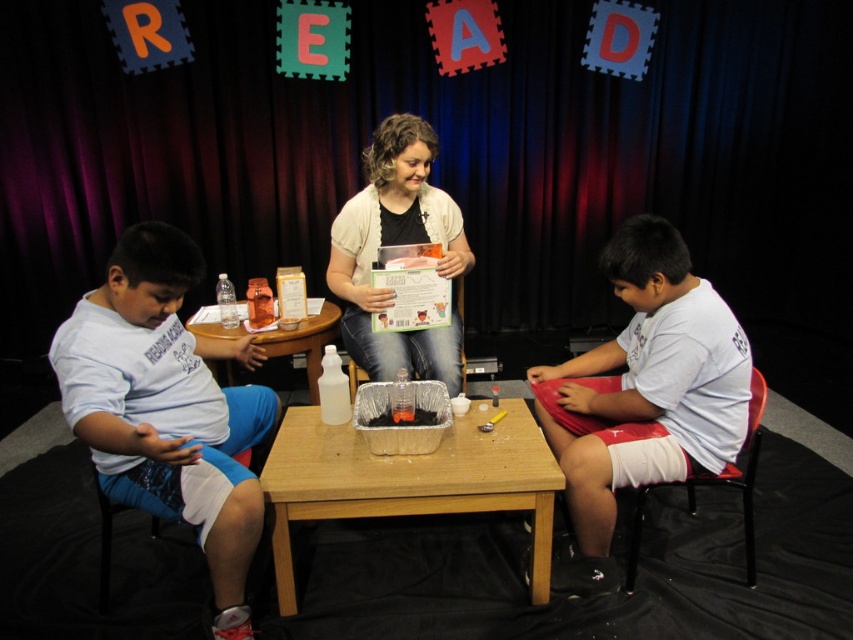
Between wooden table at center and white matte cardigan at center, which one is positioned higher?

Positioned higher is white matte cardigan at center.

Which is behind, point (506, 468) or point (440, 269)?

The point (440, 269) is more distant.

Is point (498, 470) positioned behind point (375, 339)?

That is False.

I want to click on wooden table at center, so click(409, 481).

Which is more to the right, light blue cotton shorts at left or wooden table at center?

From the viewer's perspective, wooden table at center appears more on the right side.

Looking at this image, can you confirm if light blue cotton shorts at left is smaller than wooden table at center?

No, light blue cotton shorts at left is not smaller than wooden table at center.

Image resolution: width=853 pixels, height=640 pixels. What do you see at coordinates (167, 406) in the screenshot?
I see `light blue cotton shorts at left` at bounding box center [167, 406].

The height and width of the screenshot is (640, 853). Find the location of `light blue cotton shorts at left`. light blue cotton shorts at left is located at coordinates (167, 406).

At what (x,y) coordinates should I click in order to perform the action: click on wooden table at center. Please return your answer as a coordinate pair (x, y). Looking at the image, I should click on (409, 481).

Is wooden table at center further to the viewer compared to translucent plastic container at center?

No, it is in front of translucent plastic container at center.

Where is `wooden table at center`? wooden table at center is located at coordinates (409, 481).

This screenshot has width=853, height=640. I want to click on wooden table at center, so click(x=409, y=481).